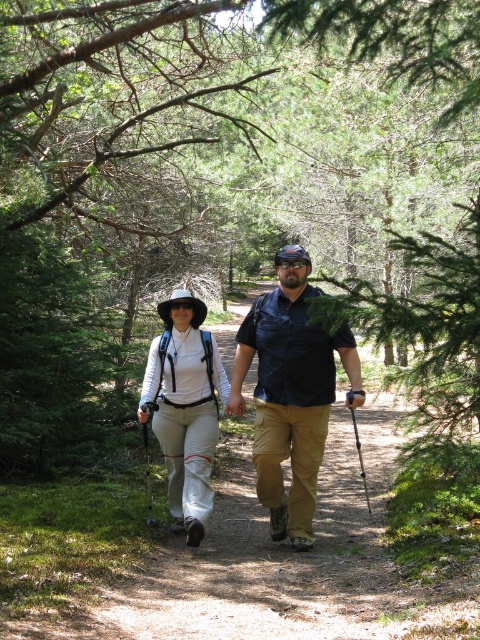
You are a hiker who wants to identify the clothing items of the person in the center. According to the image, is the matte blue shirt at center positioned higher than the white fabric hat at center?

The matte blue shirt at center is located above the white fabric hat at center, so yes, the matte blue shirt at center is positioned higher than the white fabric hat at center.

You are a photographer trying to capture both the matte blue shirt at center and the white fabric hat at center in a single frame. Which object should you focus on first to ensure both are in the frame?

The matte blue shirt at center is much taller than the white fabric hat at center, so you should focus on the matte blue shirt at center first to ensure both are in the frame.

You are a photographer trying to capture a clear shot of both the matte blue shirt at center and the white fabric hat at center. Since you want to ensure both are visible in the frame, which object should you focus on first to avoid blurring? Please explain your reasoning based on their positions.

The matte blue shirt at center is positioned on the right side of white fabric hat at center. To capture both clearly, focus on the white fabric hat at center first as it is closer to the left, allowing the camera to adjust focus towards the center area where both objects are located.